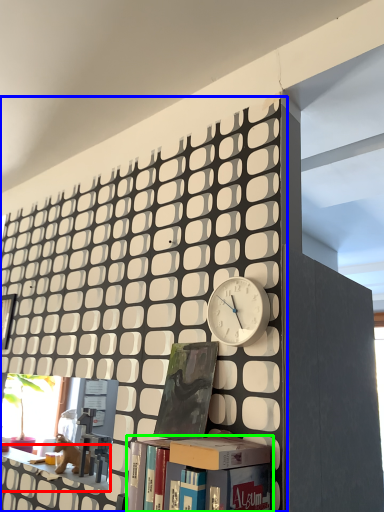
Question: Based on their relative distances, which object is farther from shelf (highlighted by a red box)? Choose from bookcase (highlighted by a blue box) and book (highlighted by a green box).

Choices:
 (A) bookcase
 (B) book

Answer: (B)